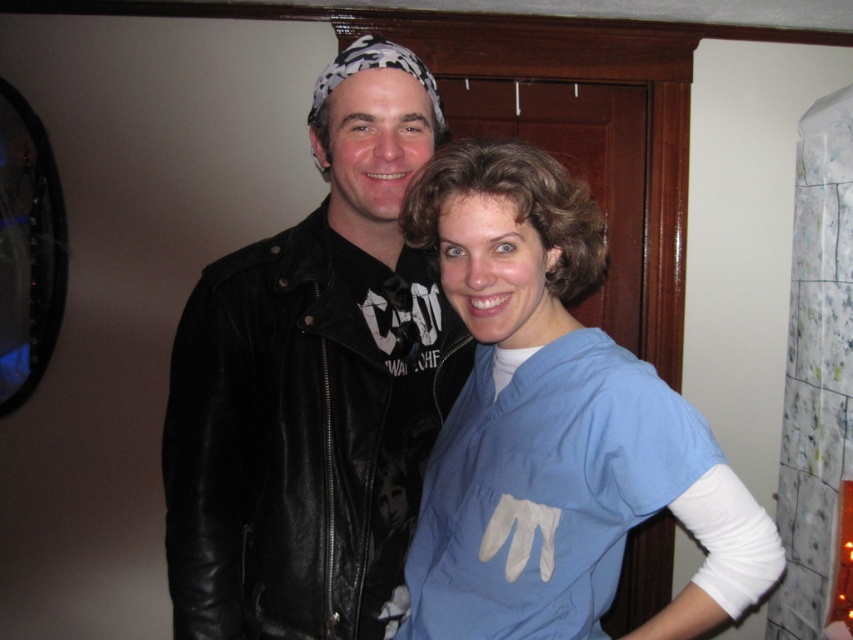
Question: Does black leather jacket at center appear on the right side of blue scrubs at center?

Choices:
 (A) yes
 (B) no

Answer: (B)

Question: Does black leather jacket at center have a lesser width compared to blue scrubs at center?

Choices:
 (A) no
 (B) yes

Answer: (B)

Question: Which object appears farthest from the camera in this image?

Choices:
 (A) black leather jacket at center
 (B) blue scrubs at center

Answer: (A)

Question: Which point appears closest to the camera in this image?

Choices:
 (A) (212, 392)
 (B) (706, 593)

Answer: (B)

Question: Does black leather jacket at center have a smaller size compared to blue scrubs at center?

Choices:
 (A) yes
 (B) no

Answer: (A)